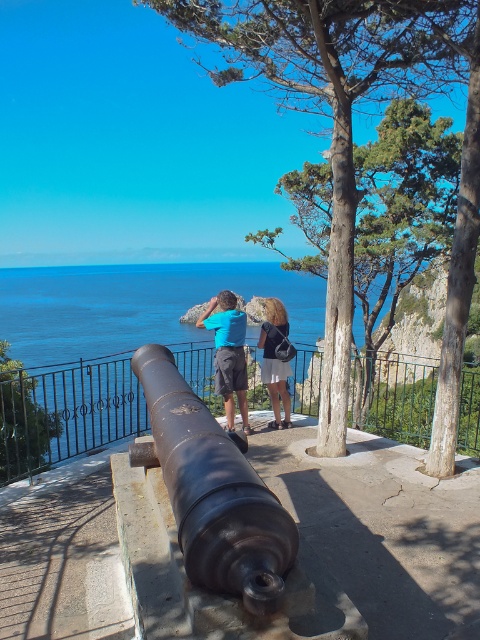
Question: Which point is closer to the camera?

Choices:
 (A) blue fabric shirt at center
 (B) matte black backpack at center
 (C) blue water at center

Answer: (C)

Question: Among these points, which one is nearest to the camera?

Choices:
 (A) (183, 384)
 (B) (157, 317)
 (C) (260, 336)
 (D) (214, 317)

Answer: (A)

Question: Which of the following is the closest to the observer?

Choices:
 (A) (222, 292)
 (B) (206, 273)

Answer: (A)

Question: Can you confirm if blue water at center is positioned below rusty metal cannon at center?

Choices:
 (A) no
 (B) yes

Answer: (A)

Question: Is blue fabric shirt at center further to the viewer compared to matte black backpack at center?

Choices:
 (A) no
 (B) yes

Answer: (A)

Question: Is rusty metal cannon at center below matte black backpack at center?

Choices:
 (A) no
 (B) yes

Answer: (B)